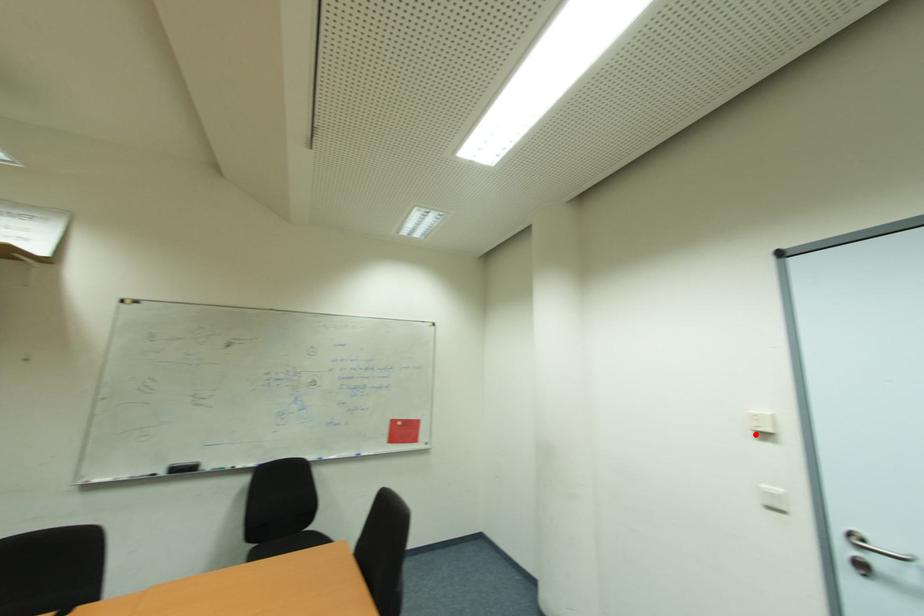
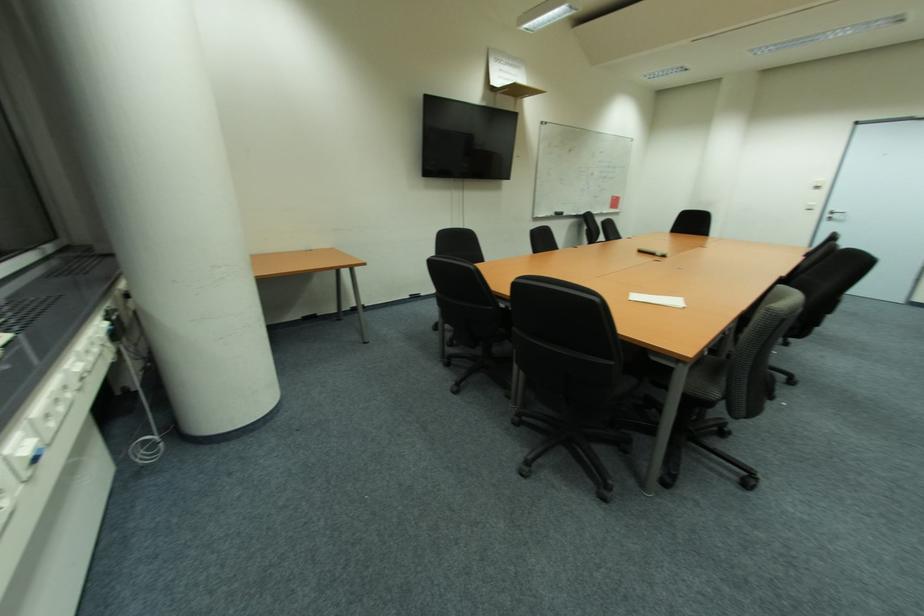
Find the pixel in the second image that matches the highlighted location in the first image.

(820, 188)